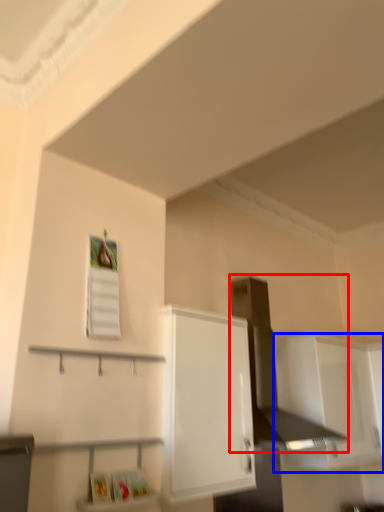
Question: Which of the following is the closest to the observer, vent (highlighted by a red box) or cabinetry (highlighted by a blue box)?

Choices:
 (A) vent
 (B) cabinetry

Answer: (A)